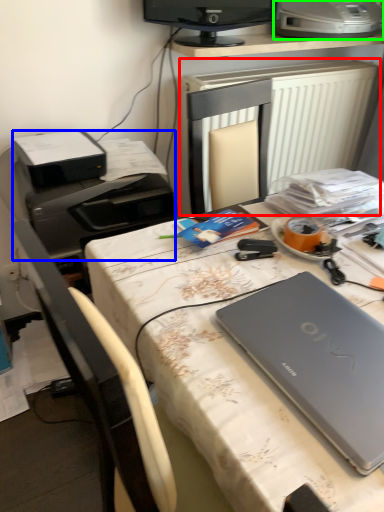
Question: Which is farther away from radiator (highlighted by a red box)? printer (highlighted by a blue box) or printer (highlighted by a green box)?

Choices:
 (A) printer
 (B) printer

Answer: (A)